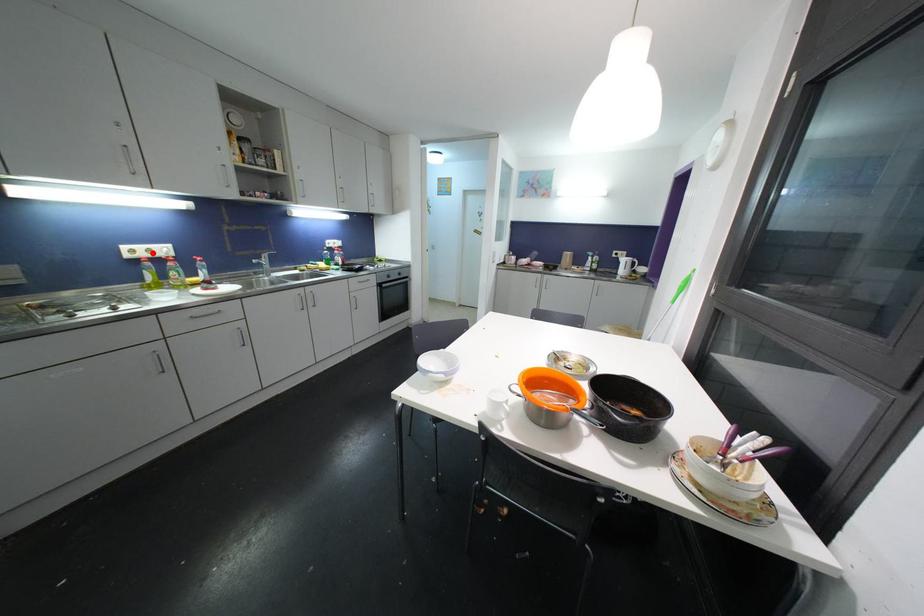
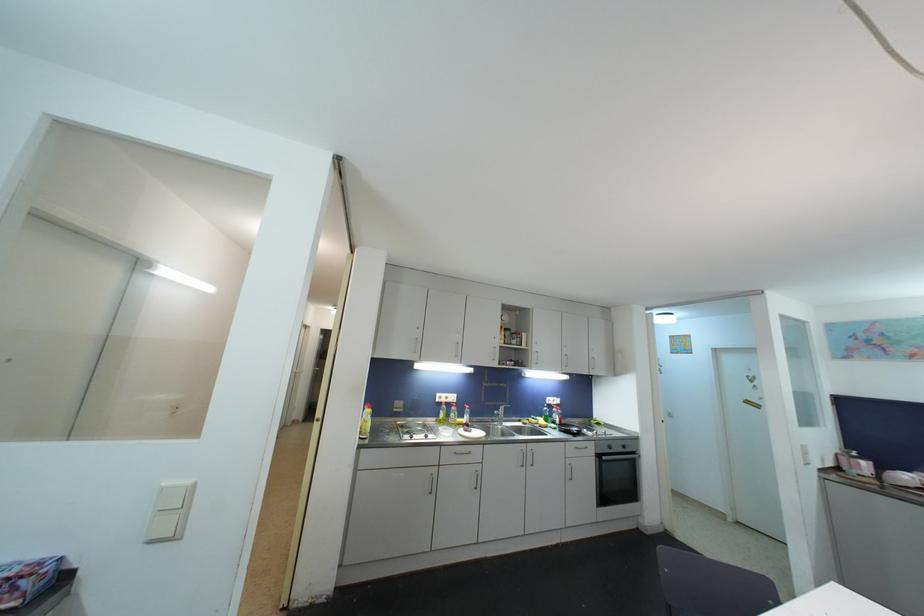
Where in the second image is the point corresponding to the highlighted location from the first image?

(450, 400)